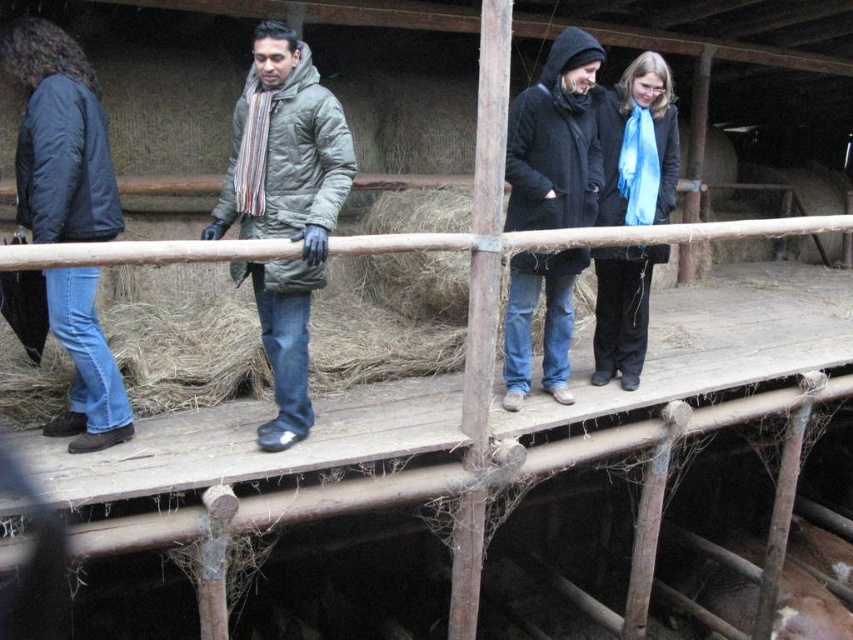
You are standing on the wooden platform in the barn and need to hand a tool to the person wearing the dark blue jacket at left and the blue scarf at center. Which person is closer to you if you are facing the platform from the front?

The dark blue jacket at left is closer to you because it is positioned under the blue scarf at center, meaning it is lower on the platform and thus nearer when facing it from the front.

You are planning to take a photo of the dark blue jacket at left and the brown furry pig at lower right. Which object should you focus on first if you want to capture both in the frame without moving the camera?

You should focus on the brown furry pig at lower right first because it occupies more space than the dark blue jacket at left, so it will be easier to ensure it fits in the frame.

You are trying to determine which object is taller between the dark blue jacket at left and the brown furry pig at lower right in the scene. Based on the description, which one is taller?

The dark blue jacket at left is taller than the brown furry pig at lower right according to the description.